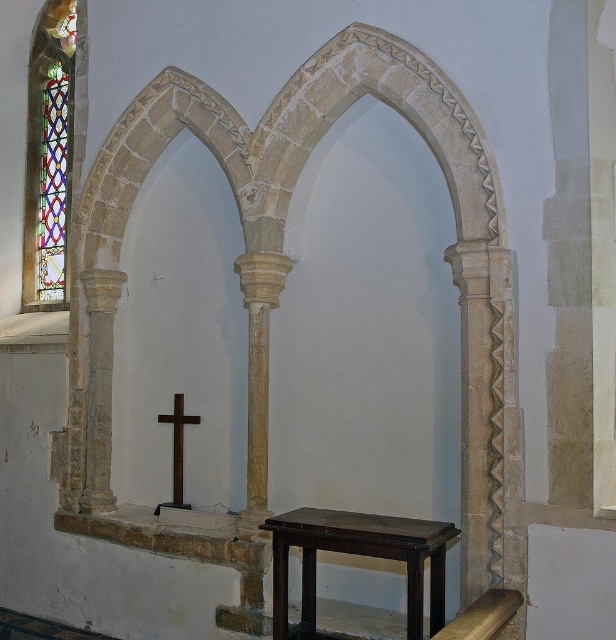
Does dark brown wooden table at center appear on the right side of dark brown wooden cross at center?

Indeed, dark brown wooden table at center is positioned on the right side of dark brown wooden cross at center.

Can you confirm if dark brown wooden table at center is positioned above dark brown wooden cross at center?

Incorrect, dark brown wooden table at center is not positioned above dark brown wooden cross at center.

Between point (288, 541) and point (182, 440), which one is positioned in front?

Point (288, 541) is in front.

Where is `dark brown wooden table at center`? The width and height of the screenshot is (616, 640). dark brown wooden table at center is located at coordinates (357, 554).

Is stained glass window at left positioned in front of multicolored stained glass at left?

Yes, it is.

Is stained glass window at left smaller than multicolored stained glass at left?

No, stained glass window at left is not smaller than multicolored stained glass at left.

I want to click on stained glass window at left, so click(x=49, y=157).

I want to click on stained glass window at left, so click(49, 157).

Does dark brown wooden table at center appear on the left side of multicolored stained glass at left?

No, dark brown wooden table at center is not to the left of multicolored stained glass at left.

Who is more forward, (310,636) or (49,138)?

Positioned in front is point (310,636).

Locate an element on the screen. dark brown wooden table at center is located at coordinates (357, 554).